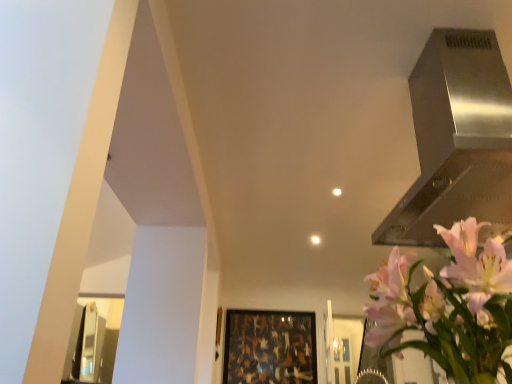
Question: Considering the positions of wooden frame at center and stainless steel vent at upper right in the image, is wooden frame at center wider or thinner than stainless steel vent at upper right?

Choices:
 (A) thin
 (B) wide

Answer: (A)

Question: In terms of height, does wooden frame at center look taller or shorter compared to stainless steel vent at upper right?

Choices:
 (A) short
 (B) tall

Answer: (B)

Question: Based on their relative distances, which object is nearer to the wooden frame at center?

Choices:
 (A) stainless steel vent at upper right
 (B) pink matte flower at upper right

Answer: (A)

Question: Considering the real-world distances, which object is closest to the pink matte flower at upper right?

Choices:
 (A) wooden frame at center
 (B) stainless steel vent at upper right

Answer: (B)